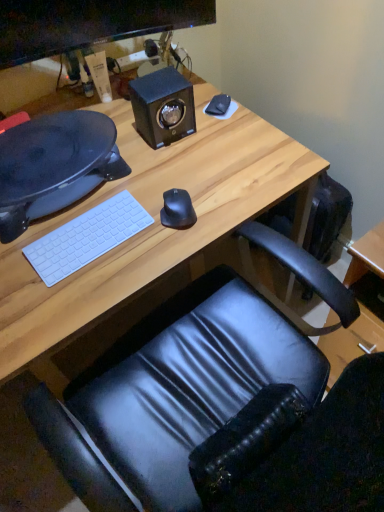
In the scene shown: What is the approximate width of black glossy speaker at left?

black glossy speaker at left is 12.61 inches wide.

Based on the photo, measure the distance between point (183, 122) and camera.

Point (183, 122) and camera are 3.78 feet apart from each other.

Where is `black matte notepad at upper right`? The width and height of the screenshot is (384, 512). black matte notepad at upper right is located at coordinates (218, 105).

The image size is (384, 512). I want to click on wooden desk at center, so click(x=153, y=223).

Describe the element at coordinates (86, 237) in the screenshot. The image size is (384, 512). I see `white matte keyboard at lower left` at that location.

In order to face matte black monitor at upper left, should I rotate leftwards or rightwards?

A 11.808 degree turn to the left will do.

This screenshot has width=384, height=512. In order to click on black glossy speaker at left in this screenshot , I will do `click(54, 165)`.

What's the angular difference between black glossy speaker at left and wooden desk at center's facing directions?

The facing directions of black glossy speaker at left and wooden desk at center are 2.38 degrees apart.

Is black glossy speaker at left positioned with its back to wooden desk at center?

No, black glossy speaker at left's orientation is not away from wooden desk at center.

Is black glossy speaker at left in front of or behind wooden desk at center in the image?

In the image, black glossy speaker at left appears behind wooden desk at center.

Does point (106, 153) come farther from viewer compared to point (98, 268)?

Yes, point (106, 153) is behind point (98, 268).

Which is closer, (x=42, y=53) or (x=11, y=298)?

Point (x=42, y=53) is positioned farther from the camera compared to point (x=11, y=298).

From the image's perspective, which object appears higher, matte black monitor at upper left or wooden desk at center?

matte black monitor at upper left appears higher in the image.

Considering the sizes of objects matte black monitor at upper left and wooden desk at center in the image provided, who is smaller, matte black monitor at upper left or wooden desk at center?

With smaller size is matte black monitor at upper left.

Is the depth of matte black monitor at upper left greater than that of wooden desk at center?

Yes, it is.

Consider the image. Based on their positions, is wooden desk at center located to the left or right of black matte mouse at center?

Based on their positions, wooden desk at center is located to the left of black matte mouse at center.

Is point (280, 156) closer or farther from the camera than point (170, 194)?

Clearly, point (280, 156) is more distant from the camera than point (170, 194).

Can you confirm if wooden desk at center is smaller than black matte mouse at center?

Incorrect, wooden desk at center is not smaller in size than black matte mouse at center.

How many degrees apart are the facing directions of wooden desk at center and black matte mouse at center?

23.2 degrees.

How many degrees apart are the facing directions of black textured speaker at upper center and matte black monitor at upper left?

They differ by 12.9 degrees in their facing directions.

Between point (177, 71) and point (7, 22), which one is positioned behind?

Point (177, 71)

Is black textured speaker at upper center positioned before matte black monitor at upper left?

No.

Could you tell me if black textured speaker at upper center is facing matte black monitor at upper left?

No, black textured speaker at upper center is not facing towards matte black monitor at upper left.

Can you confirm if black textured speaker at upper center is positioned to the right of white matte keyboard at lower left?

Yes, black textured speaker at upper center is to the right of white matte keyboard at lower left.

Locate an element on the screen. This screenshot has width=384, height=512. speaker to the right of white matte keyboard at lower left is located at coordinates (163, 106).

Based on the photo, from the image's perspective, would you say black textured speaker at upper center is shown under white matte keyboard at lower left?

No.

Which is closer, (136, 127) or (56, 248)?

Point (136, 127) is positioned farther from the camera compared to point (56, 248).

Could you tell me if black matte notepad at upper right is turned towards matte black monitor at upper left?

No, black matte notepad at upper right is not oriented towards matte black monitor at upper left.

From the image's perspective, would you say black matte notepad at upper right is shown under matte black monitor at upper left?

Yes, from the image's perspective, black matte notepad at upper right is below matte black monitor at upper left.

Does point (219, 104) lie behind point (125, 13)?

Yes, point (219, 104) is behind point (125, 13).

From the picture: Considering the sizes of objects black matte notepad at upper right and matte black monitor at upper left in the image provided, who is taller, black matte notepad at upper right or matte black monitor at upper left?

A: Standing taller between the two is matte black monitor at upper left.

Based on the photo, is matte black monitor at upper left wider or thinner than black textured speaker at upper center?

Clearly, matte black monitor at upper left has less width compared to black textured speaker at upper center.

Is the depth of matte black monitor at upper left less than that of black textured speaker at upper center?

Yes.

Does matte black monitor at upper left touch black textured speaker at upper center?

No, matte black monitor at upper left is not next to black textured speaker at upper center.

How much distance is there between matte black monitor at upper left and black textured speaker at upper center?

matte black monitor at upper left and black textured speaker at upper center are 8.37 inches apart.

At what (x,y) coordinates should I click in order to perform the action: click on desk below the black glossy speaker at left (from a real-world perspective). Please return your answer as a coordinate pair (x, y). Looking at the image, I should click on (153, 223).

Locate an element on the screen. computer monitor above the wooden desk at center (from the image's perspective) is located at coordinates (88, 24).

Consider the image. Considering their positions, is white matte keyboard at lower left positioned closer to matte black monitor at upper left than black textured speaker at upper center?

The object closer to matte black monitor at upper left is black textured speaker at upper center.

Estimate the real-world distances between objects in this image. Which object is further from matte black monitor at upper left, black textured speaker at upper center or black matte notepad at upper right?

Based on the image, black matte notepad at upper right appears to be further to matte black monitor at upper left.

Looking at the image, which one is located further to black textured speaker at upper center, matte black monitor at upper left or black glossy speaker at left?

black glossy speaker at left.

Considering their positions, is white matte keyboard at lower left positioned closer to black matte mouse at center than matte black monitor at upper left?

The object closer to black matte mouse at center is white matte keyboard at lower left.

From the image, which object appears to be nearer to black textured speaker at upper center, white matte keyboard at lower left or black glossy speaker at left?

Among the two, black glossy speaker at left is located nearer to black textured speaker at upper center.

Considering their positions, is black matte notepad at upper right positioned closer to black matte mouse at center than matte black monitor at upper left?

black matte notepad at upper right is closer to black matte mouse at center.

When comparing their distances from black textured speaker at upper center, does black glossy speaker at left or black matte notepad at upper right seem further?

black glossy speaker at left lies further to black textured speaker at upper center than the other object.

Consider the image. When comparing their distances from white matte keyboard at lower left, does matte black monitor at upper left or black matte mouse at center seem closer?

Based on the image, black matte mouse at center appears to be nearer to white matte keyboard at lower left.

Locate an element on the screen. The image size is (384, 512). mouse between matte black monitor at upper left and wooden desk at center vertically is located at coordinates (177, 209).

What are the coordinates of `speaker situated between black glossy speaker at left and black matte mouse at center from left to right` in the screenshot? It's located at (163, 106).

This screenshot has width=384, height=512. In order to click on computer keyboard situated between wooden desk at center and black matte mouse at center from left to right in this screenshot , I will do `click(86, 237)`.

Locate an element on the screen. The width and height of the screenshot is (384, 512). desktop between black textured speaker at upper center and wooden desk at center in the up-down direction is located at coordinates (54, 165).